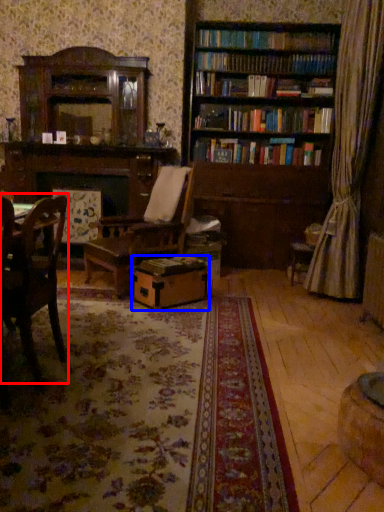
Question: Which object is closer to the camera taking this photo, chair (highlighted by a red box) or cardboard box (highlighted by a blue box)?

Choices:
 (A) chair
 (B) cardboard box

Answer: (A)